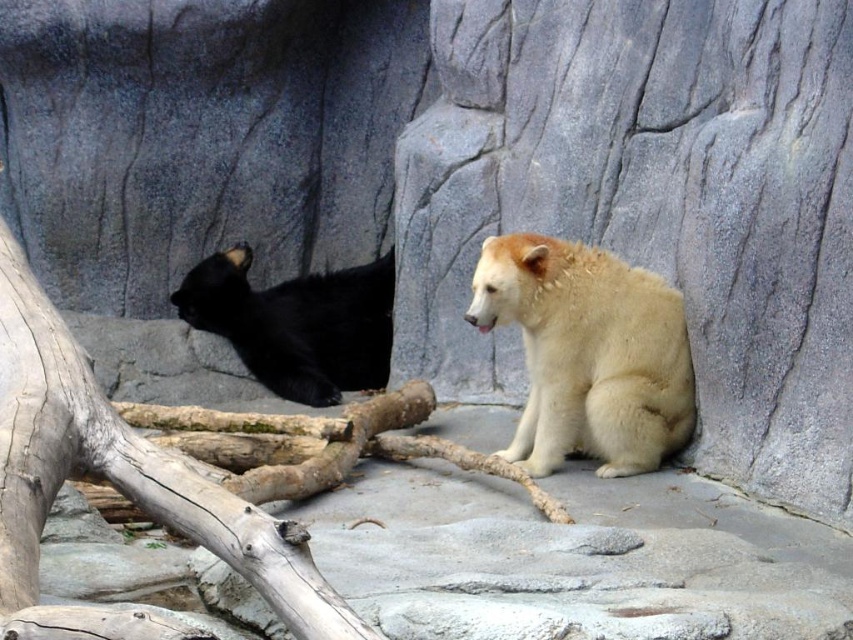
Does point (74, 381) come in front of point (239, 321)?

Yes, it is.

Is smooth gray tree trunk at left taller than black fur bear at left?

Yes.

You are a GUI agent. You are given a task and a screenshot of the screen. Output one action in this format:
    pyautogui.click(x=<x>, y=<y>)
    Task: Click on the smooth gray tree trunk at left
    
    Given the screenshot: What is the action you would take?
    pyautogui.click(x=122, y=472)

Is smooth gray tree trunk at left shorter than fuzzy white bear at center?

In fact, smooth gray tree trunk at left may be taller than fuzzy white bear at center.

Is smooth gray tree trunk at left further to the viewer compared to fuzzy white bear at center?

No.

Does point (1, 275) come behind point (523, 310)?

No, it is not.

Image resolution: width=853 pixels, height=640 pixels. Find the location of `smooth gray tree trunk at left`. smooth gray tree trunk at left is located at coordinates (122, 472).

Can you confirm if fuzzy white bear at center is wider than black fur bear at left?

No, fuzzy white bear at center is not wider than black fur bear at left.

Which is behind, point (519, 442) or point (227, 305)?

The point (227, 305) is behind.

Is point (672, 308) farther from viewer compared to point (286, 356)?

That is False.

The height and width of the screenshot is (640, 853). I want to click on fuzzy white bear at center, so click(589, 353).